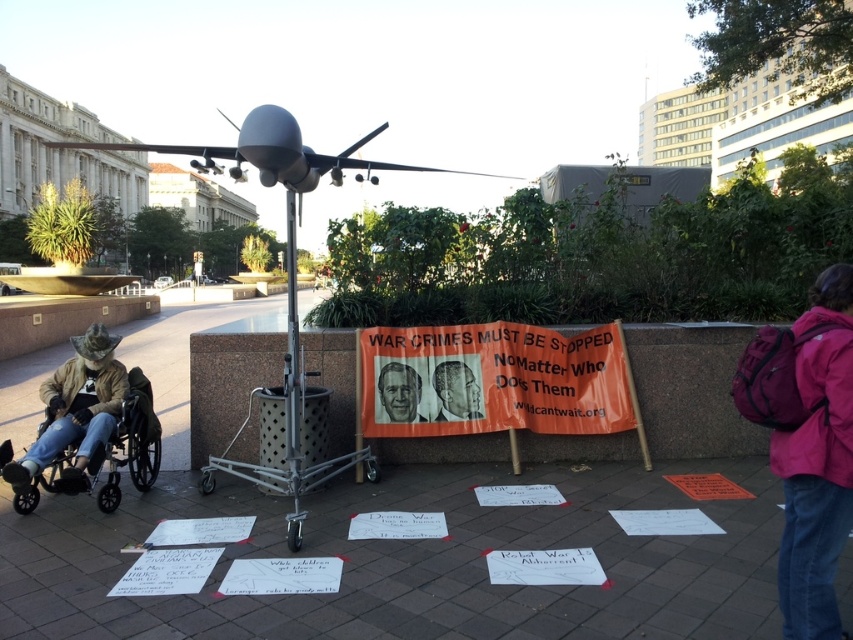
Question: Which object is the farthest from the black matte portrait at center?

Choices:
 (A) black plastic wheelchair at lower left
 (B) smooth plastic poster at center
 (C) concrete pavement at center

Answer: (A)

Question: Among these objects, which one is nearest to the camera?

Choices:
 (A) pink fabric backpack at lower right
 (B) smooth plastic poster at center
 (C) black plastic wheelchair at lower left

Answer: (A)

Question: From the image, what is the correct spatial relationship of concrete pavement at center in relation to smooth plastic poster at center?

Choices:
 (A) left
 (B) right

Answer: (A)

Question: Does black matte portrait at center appear on the right side of smooth plastic poster at center?

Choices:
 (A) no
 (B) yes

Answer: (B)

Question: Is pink fabric backpack at lower right further to the viewer compared to smooth plastic poster at center?

Choices:
 (A) yes
 (B) no

Answer: (B)

Question: Which object is closer to the camera taking this photo?

Choices:
 (A) concrete pavement at center
 (B) pink fabric backpack at lower right
 (C) black plastic wheelchair at lower left
 (D) black matte portrait at center

Answer: (B)